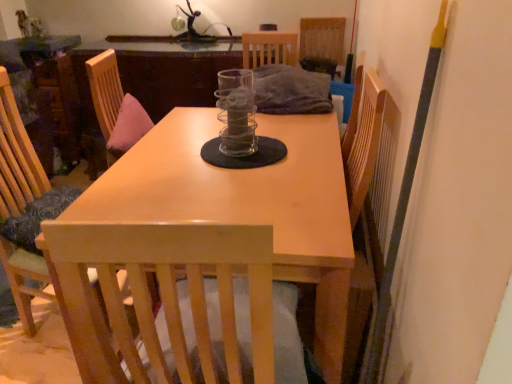
Question: Looking at the image, does clear glass jar at center seem bigger or smaller compared to metallic glass sculpture at upper center?

Choices:
 (A) big
 (B) small

Answer: (B)

Question: Is clear glass jar at center in front of or behind metallic glass sculpture at upper center in the image?

Choices:
 (A) behind
 (B) front

Answer: (B)

Question: Based on their relative distances, which object is farther from the metallic glass sculpture at upper center?

Choices:
 (A) wooden chair at left, which is the first chair from bottom to top
 (B) clear glass jar at center
 (C) woven fabric chair at upper center, which is the second chair in bottom-to-top order
 (D) light wood table at center

Answer: (D)

Question: Based on their relative distances, which object is nearer to the woven fabric chair at upper center, the first chair in the right-to-left sequence?

Choices:
 (A) wooden chair at left, placed as the 2th chair when sorted from back to front
 (B) clear glass jar at center
 (C) light wood table at center
 (D) metallic glass sculpture at upper center

Answer: (D)